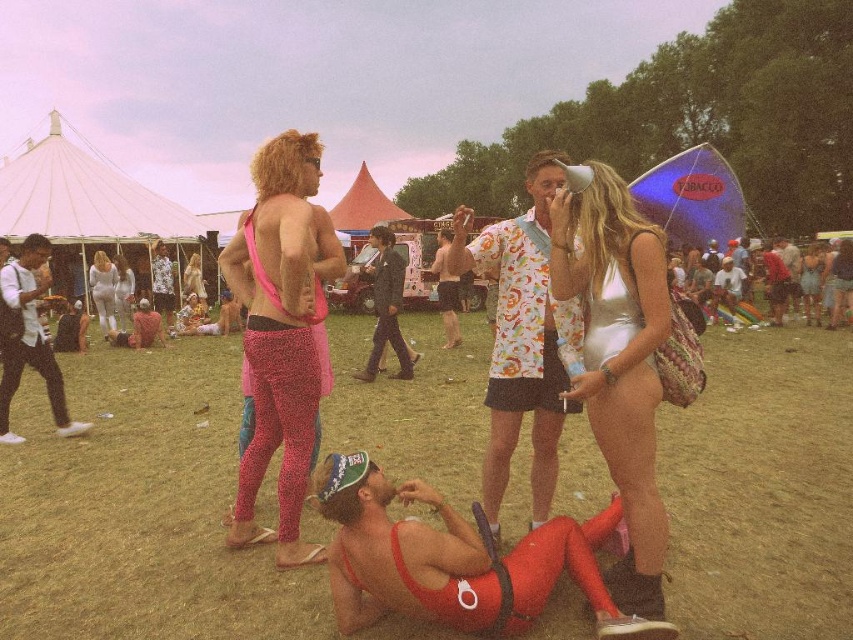
Question: Can you confirm if white matte leggings at center is positioned to the left of silver metallic bodysuit at center?

Choices:
 (A) no
 (B) yes

Answer: (B)

Question: Which point is farther to the camera?

Choices:
 (A) neon pink spandex pants at center
 (B) printed cotton shirt at center
 (C) dark gray leather jacket at center
 (D) white cotton shirt at left

Answer: (A)

Question: Which of the following is the closest to the observer?

Choices:
 (A) (352, 524)
 (B) (764, 253)
 (C) (108, 332)
 (D) (160, 241)

Answer: (A)

Question: Estimate the real-world distances between objects in this image. Which object is farther from the silver metallic swimsuit at center?

Choices:
 (A) white cotton shirt at left
 (B) silver metallic bodysuit at center
 (C) pink spandex bikini top at center
 (D) matte pink shorts at center

Answer: (D)

Question: Can you confirm if silver metallic swimsuit at center is positioned below smooth skin torso at center?

Choices:
 (A) yes
 (B) no

Answer: (A)

Question: Does matte pink shorts at center come in front of silver metallic bodysuit at center?

Choices:
 (A) no
 (B) yes

Answer: (A)